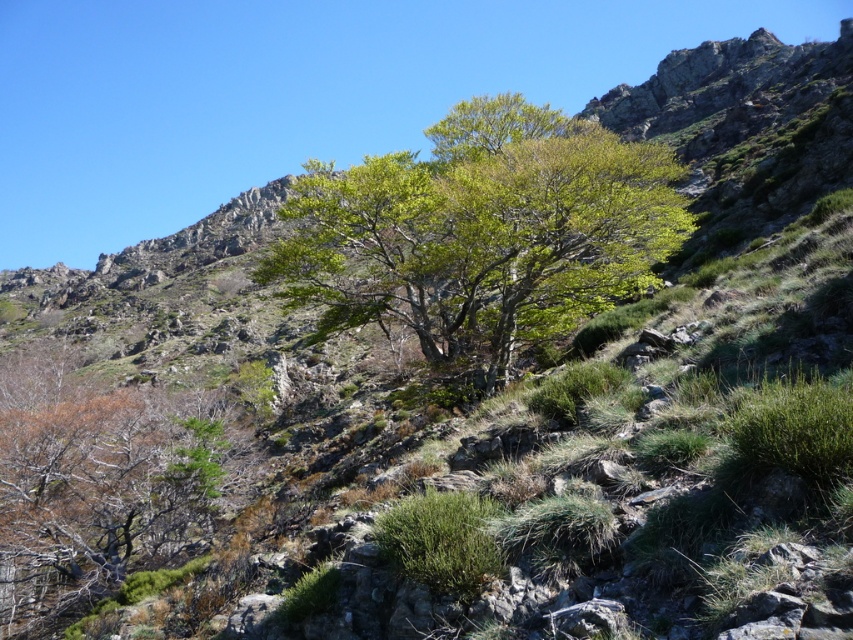
Question: Which of the following is the closest to the observer?

Choices:
 (A) green leafy tree at center
 (B) brown/dried wood at left

Answer: (B)

Question: Which object appears farthest from the camera in this image?

Choices:
 (A) green leafy tree at center
 (B) brown/dried wood at left

Answer: (A)

Question: Is green leafy tree at center smaller than brown/dried wood at left?

Choices:
 (A) no
 (B) yes

Answer: (A)

Question: Is the position of green leafy tree at center more distant than that of brown/dried wood at left?

Choices:
 (A) no
 (B) yes

Answer: (B)

Question: Can you confirm if green leafy tree at center is thinner than brown/dried wood at left?

Choices:
 (A) no
 (B) yes

Answer: (A)